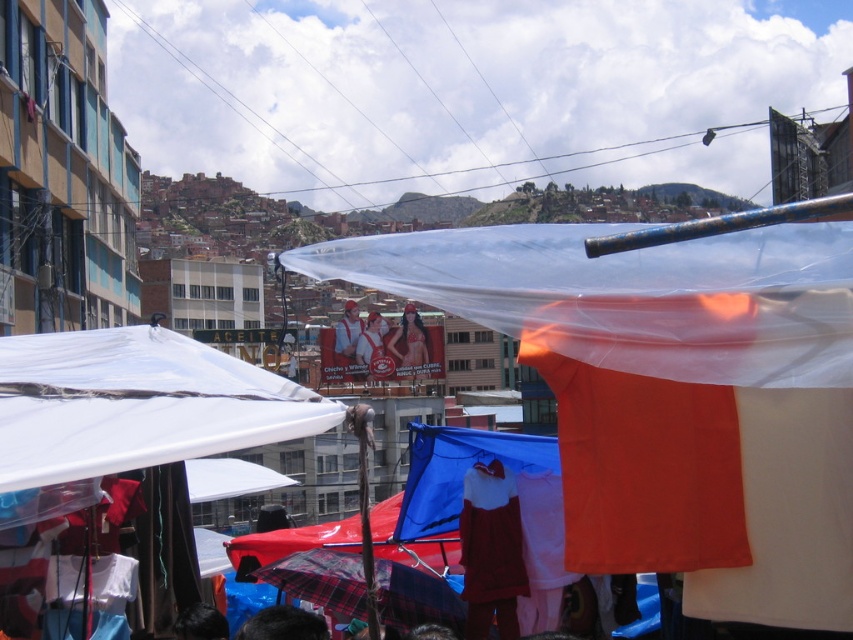
Question: Is the position of transparent plastic canopy at center more distant than that of blue fabric canopy at center?

Choices:
 (A) yes
 (B) no

Answer: (B)

Question: Is transparent plastic canopy at center below matte red shirt at center?

Choices:
 (A) yes
 (B) no

Answer: (B)

Question: Which point is closer to the camera?

Choices:
 (A) plaid fabric umbrella at center
 (B) transparent plastic canopy at center

Answer: (B)

Question: Which of the following is the closest to the observer?

Choices:
 (A) white fabric shirt at center
 (B) blue fabric canopy at center
 (C) white matte canopy at upper left
 (D) plaid fabric umbrella at center

Answer: (C)

Question: Does white matte canopy at upper left have a lesser width compared to matte red shirt at center?

Choices:
 (A) no
 (B) yes

Answer: (A)

Question: Which point is farther to the camera?

Choices:
 (A) blue fabric canopy at center
 (B) white matte canopy at upper left
 (C) matte red shirt at center

Answer: (C)